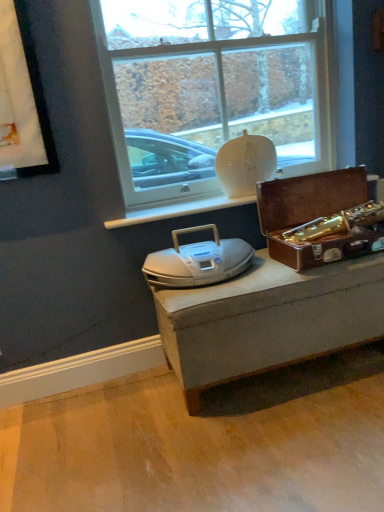
Question: Considering the relative positions of white matte vase at upper center and shiny brown suitcase at right in the image provided, is white matte vase at upper center to the right of shiny brown suitcase at right from the viewer's perspective?

Choices:
 (A) no
 (B) yes

Answer: (A)

Question: Would you consider white matte vase at upper center to be distant from shiny brown suitcase at right?

Choices:
 (A) no
 (B) yes

Answer: (A)

Question: Is the depth of white matte vase at upper center greater than that of shiny brown suitcase at right?

Choices:
 (A) yes
 (B) no

Answer: (A)

Question: Is shiny brown suitcase at right located within white matte vase at upper center?

Choices:
 (A) yes
 (B) no

Answer: (B)

Question: Does white matte vase at upper center appear on the left side of shiny brown suitcase at right?

Choices:
 (A) yes
 (B) no

Answer: (A)

Question: Looking at their shapes, would you say white plastic stereo at center is wider or thinner than shiny brown suitcase at right?

Choices:
 (A) wide
 (B) thin

Answer: (B)

Question: Would you say white plastic stereo at center is inside or outside shiny brown suitcase at right?

Choices:
 (A) outside
 (B) inside

Answer: (A)

Question: Based on their sizes in the image, would you say white plastic stereo at center is bigger or smaller than shiny brown suitcase at right?

Choices:
 (A) big
 (B) small

Answer: (B)

Question: Does point (241, 242) appear closer or farther from the camera than point (304, 231)?

Choices:
 (A) closer
 (B) farther

Answer: (B)

Question: Looking at the image, does white plastic stereo at center seem bigger or smaller compared to white matte vase at upper center?

Choices:
 (A) small
 (B) big

Answer: (A)

Question: Considering the positions of white plastic stereo at center and white matte vase at upper center in the image, is white plastic stereo at center wider or thinner than white matte vase at upper center?

Choices:
 (A) wide
 (B) thin

Answer: (A)

Question: From the image's perspective, is white plastic stereo at center positioned above or below white matte vase at upper center?

Choices:
 (A) above
 (B) below

Answer: (B)

Question: Considering their positions, is white plastic stereo at center located in front of or behind white matte vase at upper center?

Choices:
 (A) front
 (B) behind

Answer: (A)

Question: From a real-world perspective, is shiny brown suitcase at right physically located above or below white matte vase at upper center?

Choices:
 (A) below
 (B) above

Answer: (A)

Question: In the image, is shiny brown suitcase at right positioned in front of or behind white matte vase at upper center?

Choices:
 (A) behind
 (B) front

Answer: (B)